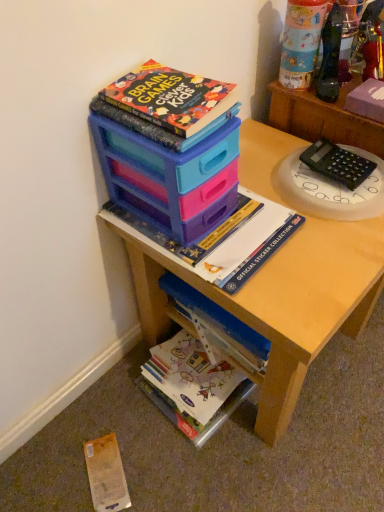
Question: Is matte plastic cup at upper right in contact with matte plastic storage box at upper center?

Choices:
 (A) no
 (B) yes

Answer: (A)

Question: Does matte plastic cup at upper right turn towards matte plastic storage box at upper center?

Choices:
 (A) no
 (B) yes

Answer: (A)

Question: Is the depth of matte plastic cup at upper right greater than that of matte plastic storage box at upper center?

Choices:
 (A) yes
 (B) no

Answer: (A)

Question: Is matte plastic cup at upper right positioned far away from matte plastic storage box at upper center?

Choices:
 (A) no
 (B) yes

Answer: (A)

Question: Is matte plastic cup at upper right to the left of matte plastic storage box at upper center from the viewer's perspective?

Choices:
 (A) no
 (B) yes

Answer: (A)

Question: Is matte plastic storage box at upper center a part of matte plastic cup at upper right?

Choices:
 (A) yes
 (B) no

Answer: (B)

Question: From a real-world perspective, does matte plastic storage box at upper center sit lower than yellow paper at lower left?

Choices:
 (A) no
 (B) yes

Answer: (A)

Question: Is matte plastic storage box at upper center outside of yellow paper at lower left?

Choices:
 (A) no
 (B) yes

Answer: (B)

Question: Does matte plastic storage box at upper center contain yellow paper at lower left?

Choices:
 (A) yes
 (B) no

Answer: (B)

Question: Is matte plastic storage box at upper center next to yellow paper at lower left?

Choices:
 (A) no
 (B) yes

Answer: (A)

Question: Is matte plastic storage box at upper center thinner than yellow paper at lower left?

Choices:
 (A) no
 (B) yes

Answer: (A)

Question: Could you tell me if matte plastic storage box at upper center is turned towards yellow paper at lower left?

Choices:
 (A) yes
 (B) no

Answer: (B)

Question: Considering the relative sizes of black plastic calculator at upper right and white glossy book at lower center, which is the 1th book from bottom to top, in the image provided, is black plastic calculator at upper right thinner than white glossy book at lower center, which is the 1th book from bottom to top,?

Choices:
 (A) yes
 (B) no

Answer: (A)